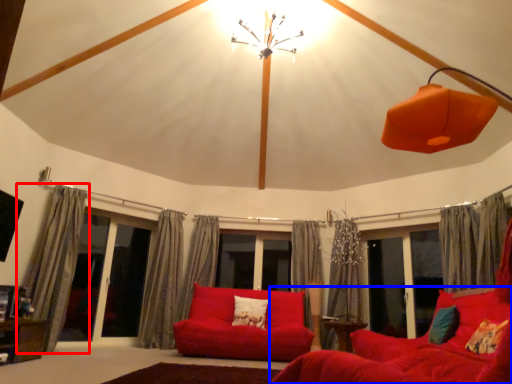
Question: Which object is closer to the camera taking this photo, curtain (highlighted by a red box) or studio couch (highlighted by a blue box)?

Choices:
 (A) curtain
 (B) studio couch

Answer: (B)